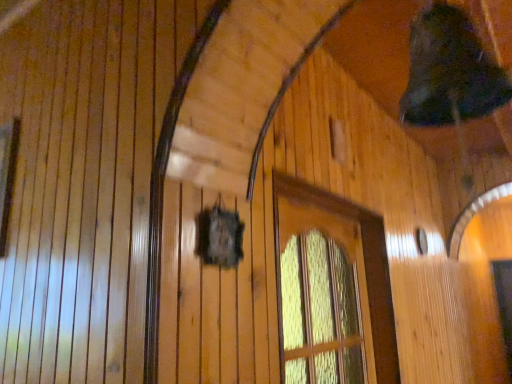
What is the approximate height of wooden stained glass door at center?

27.40 inches.

Describe the element at coordinates (322, 298) in the screenshot. The height and width of the screenshot is (384, 512). I see `wooden stained glass door at center` at that location.

At what (x,y) coordinates should I click in order to perform the action: click on wooden stained glass door at center. Please return your answer as a coordinate pair (x, y). This screenshot has height=384, width=512. Looking at the image, I should click on (322, 298).

Where is `wooden stained glass door at center`? wooden stained glass door at center is located at coordinates (322, 298).